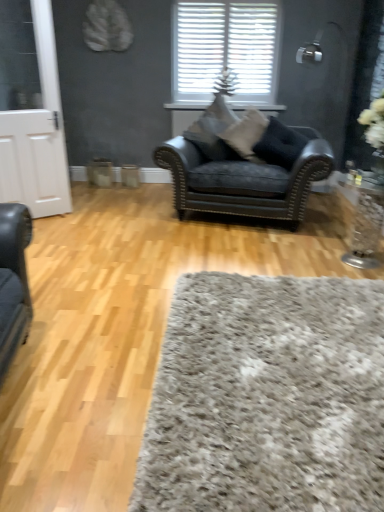
Question: Does point (269, 117) appear closer or farther from the camera than point (213, 22)?

Choices:
 (A) farther
 (B) closer

Answer: (B)

Question: From a real-world perspective, is black leather pillow at center, the 1th pillow in the right-to-left sequence, physically located above or below white textured blinds at upper center?

Choices:
 (A) below
 (B) above

Answer: (A)

Question: Estimate the real-world distances between objects in this image. Which object is farther from the clear glass vase at right?

Choices:
 (A) suede-like gray pillow at center, which is the 1th pillow in left-to-right order
 (B) white textured blinds at upper center
 (C) light brown wood flooring at center
 (D) shaggy gray rug at lower center
 (E) velvet black armchair at center

Answer: (B)

Question: Which object is positioned farthest from the clear glass vase at right?

Choices:
 (A) suede-like gray pillow at center, which is counted as the third pillow, starting from the right
 (B) white textured blinds at upper center
 (C) shaggy gray rug at lower center
 (D) light brown wood flooring at center
 (E) velvet black armchair at center

Answer: (B)